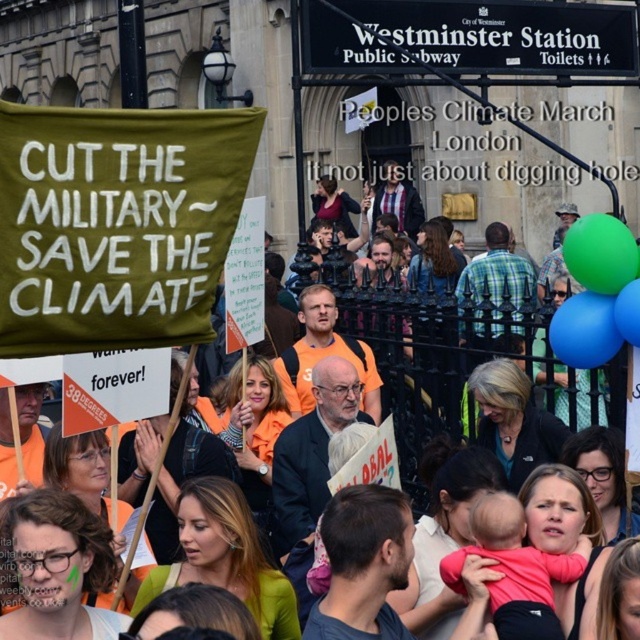
Question: Is green fabric banner at upper left above pink fabric baby at lower center?

Choices:
 (A) no
 (B) yes

Answer: (B)

Question: From the image, what is the correct spatial relationship of green fabric banner at upper left in relation to pink fabric baby at lower center?

Choices:
 (A) right
 (B) left

Answer: (B)

Question: Among these objects, which one is nearest to the camera?

Choices:
 (A) pink fabric baby at lower center
 (B) green fabric banner at upper left

Answer: (A)

Question: Which point appears closest to the camera in this image?

Choices:
 (A) (550, 554)
 (B) (589, 358)

Answer: (A)

Question: Which point is closer to the camera?

Choices:
 (A) (452, 323)
 (B) (508, 493)

Answer: (B)

Question: Can you confirm if green fabric banner at upper left is wider than pink fabric baby at lower center?

Choices:
 (A) no
 (B) yes

Answer: (B)